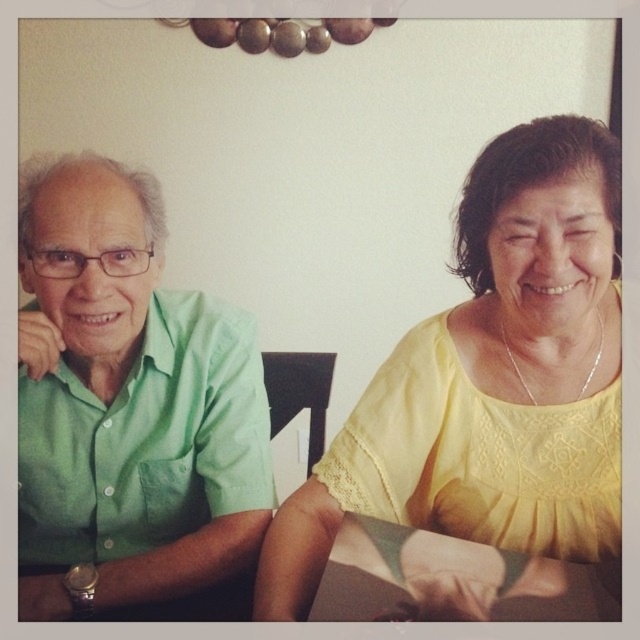
You are an interior designer working on a project and need to place a decorative item exactly at the center of the room. The room has a coordinate system where the bottom left corner is at point 0,0 and the top right corner is at point 1,1. You have a yellow lace blouse at upper right located at point 0.594, 0.767. Is this position suitable for placing the decorative item at the center of the room?

The center of the room would be at point (320, 320). The yellow lace blouse at upper right is located at point (490, 380), which is closer to the upper right corner than the center. Therefore, this position is not suitable for placing the decorative item at the center of the room.

You are an interior designer planning to place a new lamp on the table between the green matte shirt at left and the yellow top with lace detailing at the neckline. The lamp requires a space of 15 cm in diameter. Can you confirm if there is enough space between them?

The position of green matte shirt at left is at point (128, 403). However, without the position of the yellow top with lace detailing at the neckline, it is impossible to determine the distance between them. Please provide the coordinates of the yellow top with lace detailing at the neckline to calculate the required space.

You are taking a photo of two people sitting at a table. There are two points marked in the image, point A at coordinates point (x=68, y=461) and point B at coordinates point (x=480, y=588). If you want to focus on the point that is closer to you, which point should you choose?

Point A at coordinates point (x=68, y=461) is closer to the camera than point B at coordinates point (x=480, y=588), so you should choose point A.